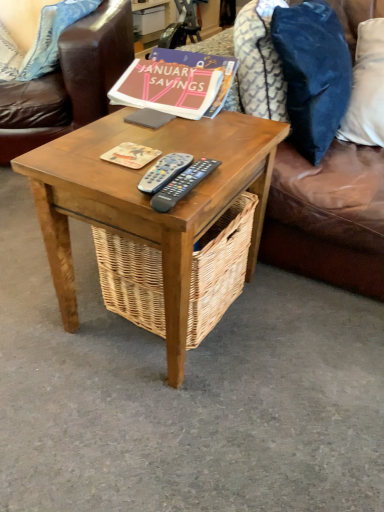
Image resolution: width=384 pixels, height=512 pixels. In order to click on vacant space in between woven wood picnic basket at center and brown leather couch at upper right in this screenshot , I will do `click(294, 316)`.